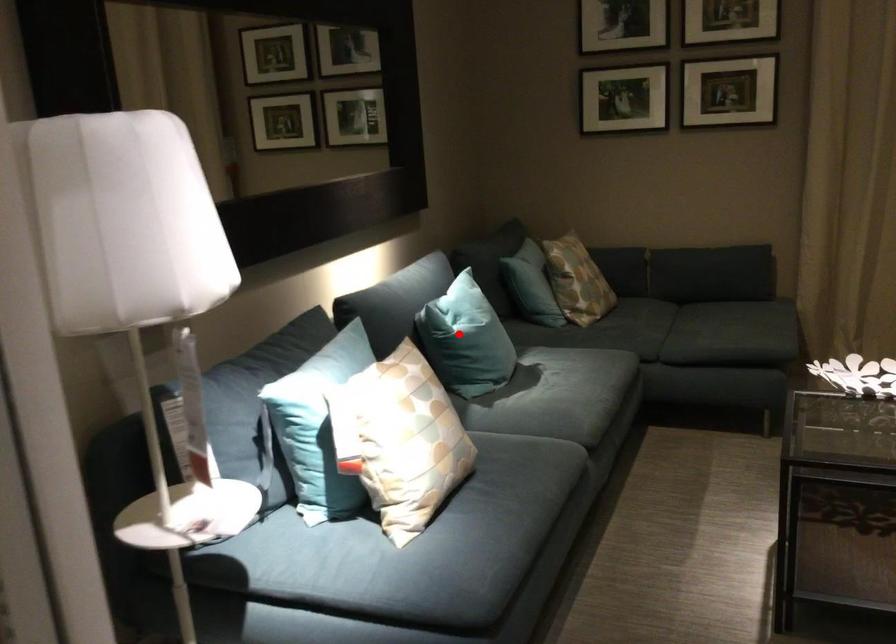
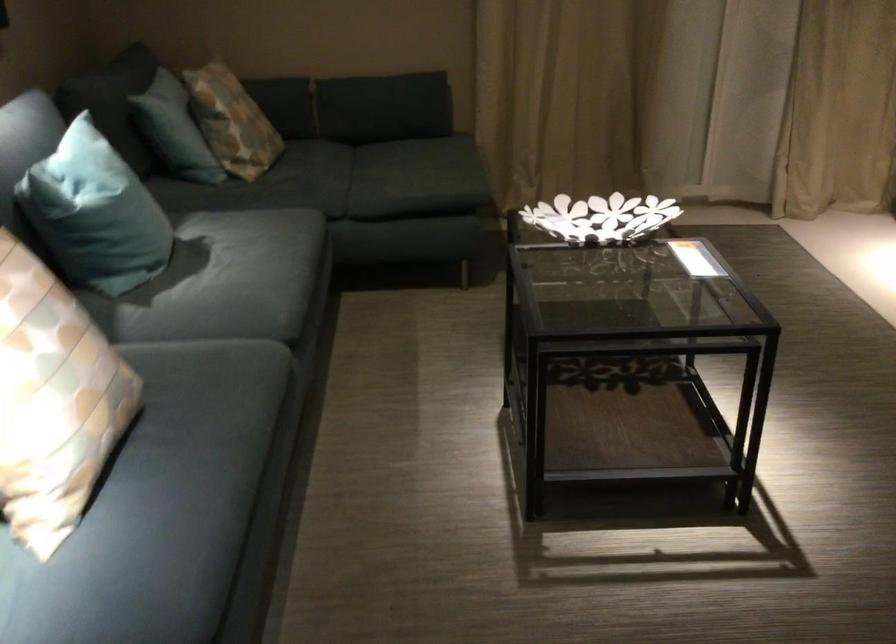
Question: I am providing you with two images of the same scene from different viewpoints. In image1, a red point is highlighted. Considering the same 3D point in image2, which of the following is correct?

Choices:
 (A) It is closer
 (B) It is farther

Answer: (A)